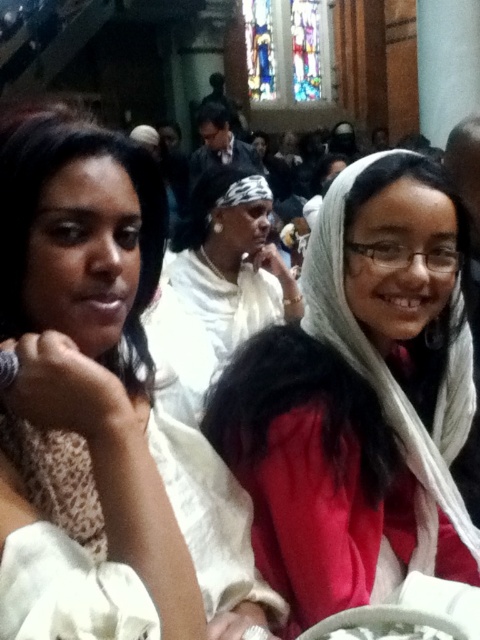
Between white fabric scarf at center and red matte scarf at center, which one is positioned lower?

red matte scarf at center is below.

Can you confirm if white fabric scarf at center is positioned below red matte scarf at center?

No, white fabric scarf at center is not below red matte scarf at center.

What do you see at coordinates (103, 412) in the screenshot? I see `white fabric scarf at center` at bounding box center [103, 412].

Where is `white fabric scarf at center`? white fabric scarf at center is located at coordinates (103, 412).

Between red matte scarf at center and white fabric headscarf at center, which one is positioned lower?

red matte scarf at center

Where is `red matte scarf at center`? The height and width of the screenshot is (640, 480). red matte scarf at center is located at coordinates (360, 400).

Is point (73, 625) less distant than point (265, 282)?

That is True.

Can you confirm if white fabric scarf at center is positioned below white fabric headscarf at center?

Indeed, white fabric scarf at center is positioned under white fabric headscarf at center.

Identify the location of white fabric scarf at center. Image resolution: width=480 pixels, height=640 pixels. (103, 412).

Where is `white fabric scarf at center`? white fabric scarf at center is located at coordinates (103, 412).